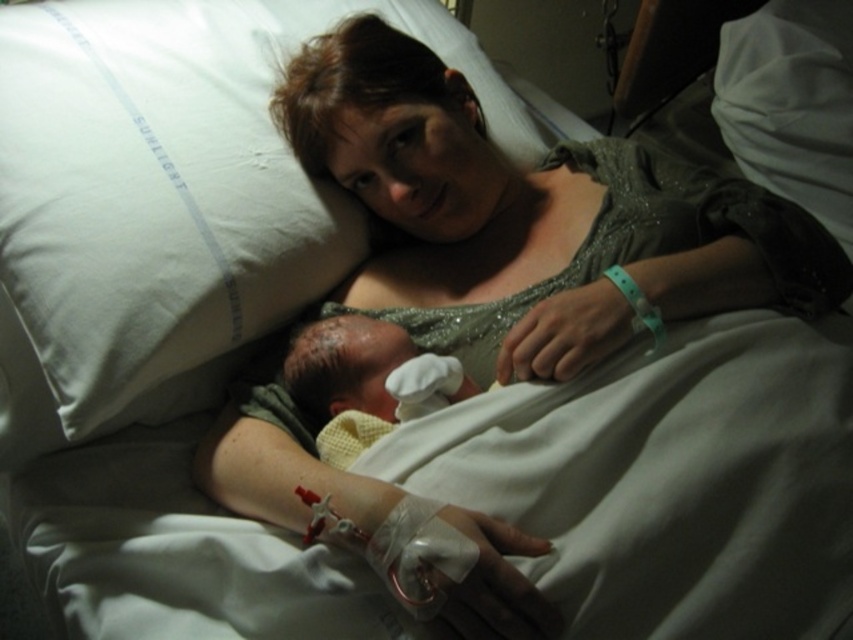
You are a photographer setting up a camera in the room. The camera is at position 0.312, 0.198. Where should you place the camera to capture the white soft pillow at upper left in the frame?

The white soft pillow at upper left is located at point (x=167, y=198), so you should position the camera there to capture it in the frame.

In the scene shown: You are a nurse in a hospital room and need to place a medical kit on a surface that is exactly 38.35 inches away from you. You see a point marked at coordinate point (161,45). Can you use that point as the location to place the medical kit?

Yes, the point marked at coordinate point (161,45) is exactly 38.35 inches away from you, so you can place the medical kit there.

You are a nurse in a hospital room and need to adjust the position of the white soft pillow at upper left and the yellow textured blanket at center. Based on their current positions, which object is located higher?

The white soft pillow at upper left is above the yellow textured blanket at center, so it is located higher.